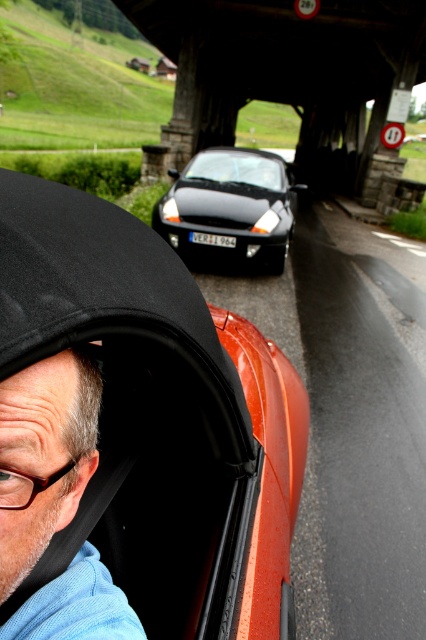
Looking at this image, does shiny orange car at center have a greater width compared to glossy black car at center?

No, shiny orange car at center is not wider than glossy black car at center.

Locate an element on the screen. shiny orange car at center is located at coordinates (158, 417).

Does shiny orange car at center have a smaller size compared to wooden bridge at center?

Correct, shiny orange car at center occupies less space than wooden bridge at center.

Between shiny orange car at center and wooden bridge at center, which one appears on the right side from the viewer's perspective?

From the viewer's perspective, wooden bridge at center appears more on the right side.

Image resolution: width=426 pixels, height=640 pixels. Find the location of `shiny orange car at center`. shiny orange car at center is located at coordinates (158, 417).

Measure the distance between shiny orange car at center and camera.

shiny orange car at center and camera are 43.39 centimeters apart from each other.

How much distance is there between shiny orange car at center and light blue fabric at lower left?

shiny orange car at center and light blue fabric at lower left are 16.61 inches apart.

In the scene shown: Measure the distance between shiny orange car at center and camera.

shiny orange car at center and camera are 17.08 inches apart.

Where is `shiny orange car at center`? shiny orange car at center is located at coordinates (158, 417).